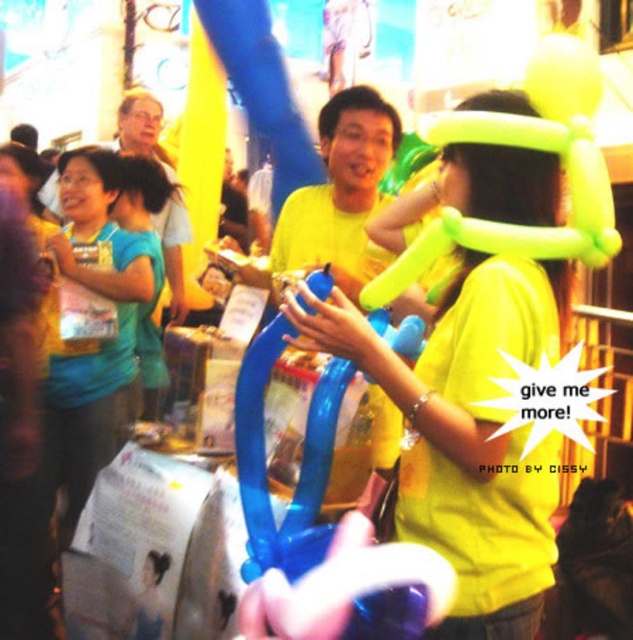
You are a photographer at the event and want to capture a photo where the blue matte shirt at center and the yellow matte balloon at center are both clearly visible. Based on their positions, which object should you focus on first to ensure both are in the frame?

The blue matte shirt at center is below the yellow matte balloon at center, so focusing on the yellow matte balloon at center first will ensure the blue matte shirt at center is also in the frame since it is positioned lower.